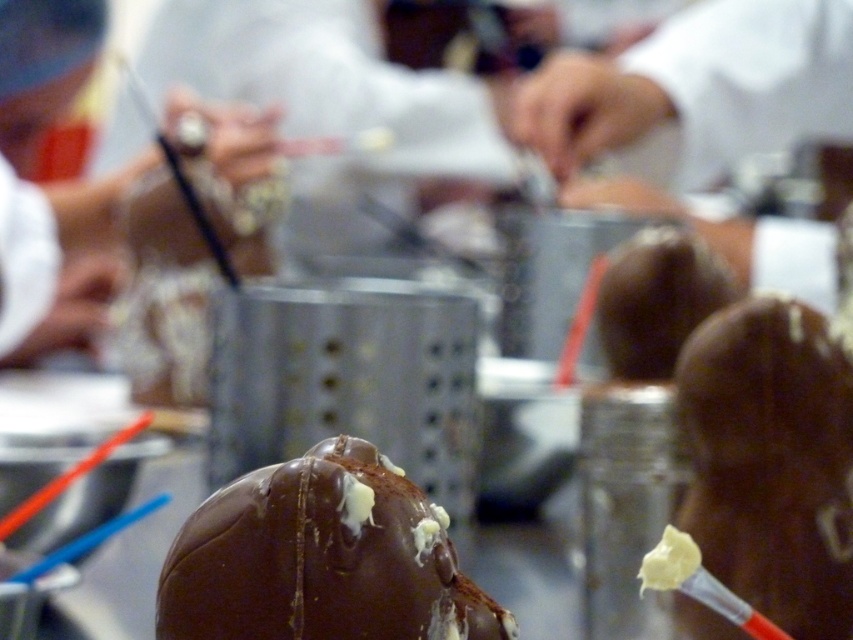
Question: Among these objects, which one is nearest to the camera?

Choices:
 (A) matte white chef's hat at upper left
 (B) shiny chocolate truffle at center

Answer: (B)

Question: Which object is farther from the camera taking this photo?

Choices:
 (A) shiny chocolate truffle at center
 (B) matte white chef's hat at upper left
 (C) shiny chocolate candy at center
 (D) shiny chocolate ball at center

Answer: (B)

Question: Does shiny chocolate candy at center have a greater width compared to shiny chocolate ball at center?

Choices:
 (A) yes
 (B) no

Answer: (B)

Question: Which object is closer to the camera taking this photo?

Choices:
 (A) shiny chocolate truffle at center
 (B) shiny chocolate candy at center

Answer: (B)

Question: Where is shiny chocolate candy at center located in relation to shiny chocolate truffle at center in the image?

Choices:
 (A) right
 (B) left

Answer: (A)

Question: Where is shiny chocolate candy at center located in relation to shiny chocolate truffle at center in the image?

Choices:
 (A) above
 (B) below

Answer: (B)